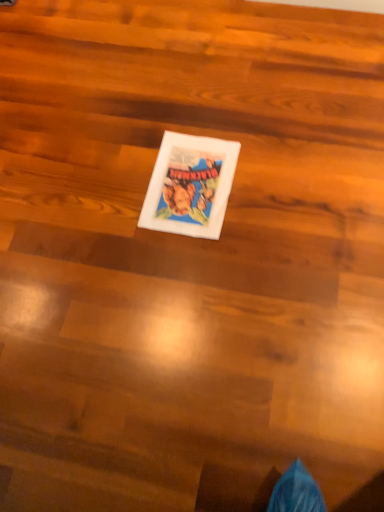
Question: Should I look upward or downward to see white matte comic book at center?

Choices:
 (A) down
 (B) up

Answer: (B)